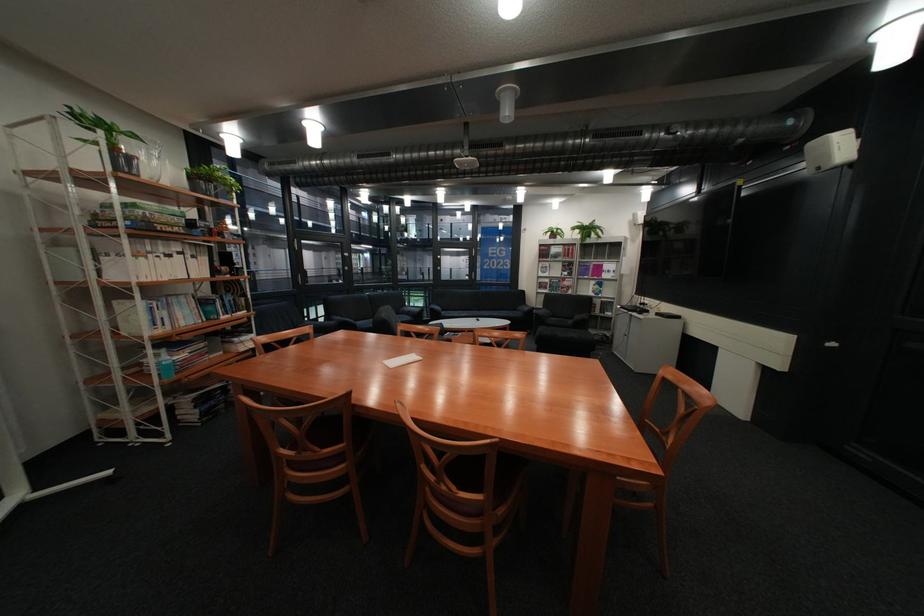
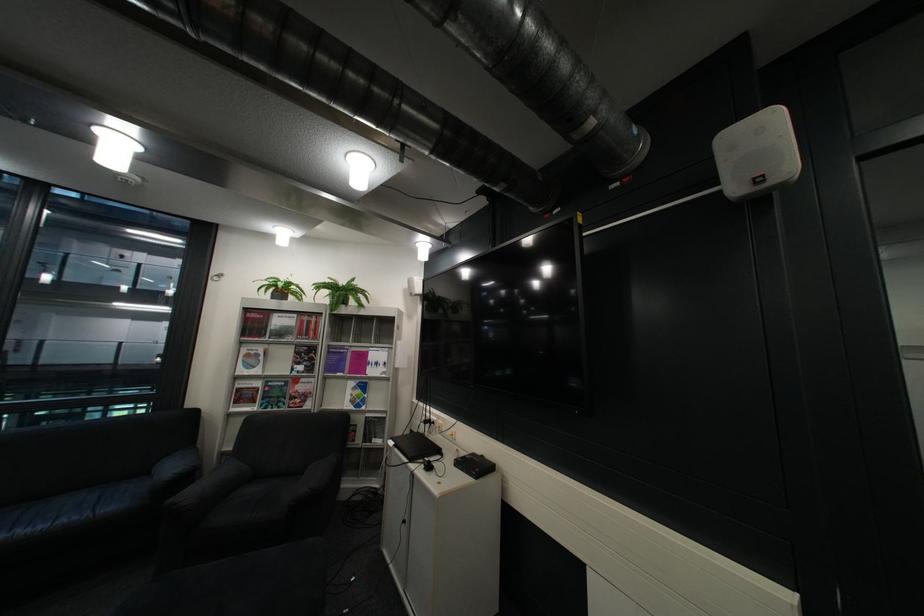
Where in the second image is the point corresponding to point 570,285 from the first image?

(290, 394)